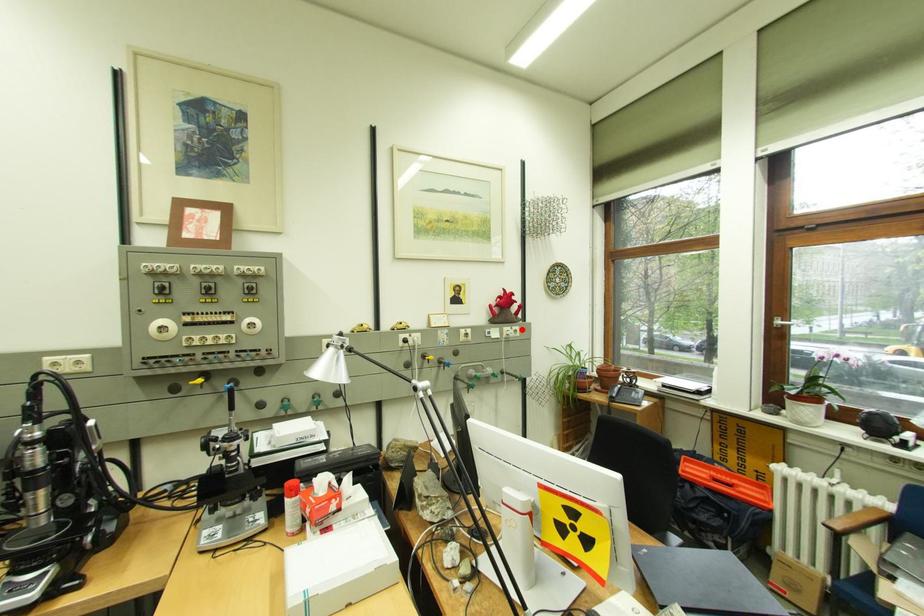
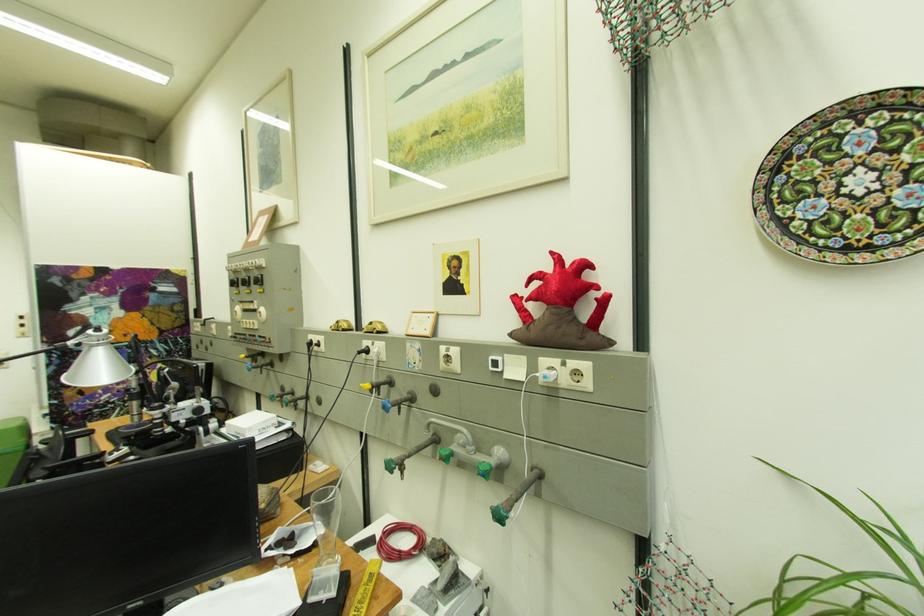
Locate, in the second image, the point that corresponds to the highlighted location in the first image.

(575, 365)